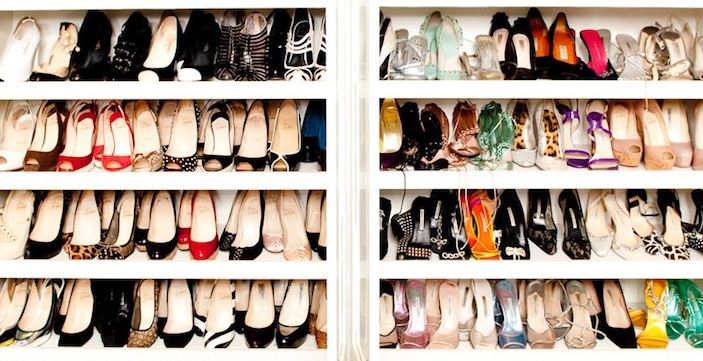
Locate an element on the screen. The image size is (703, 361). six shoes from the left on the second shelf up on the left is located at coordinates (13, 223), (46, 220), (70, 220), (86, 219), (105, 207), (122, 215).